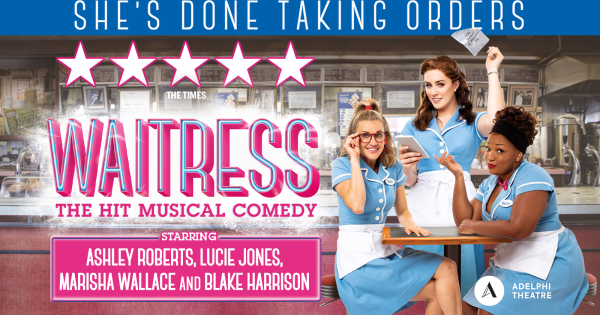
The image size is (600, 315). I want to click on coffee carafe, so click(x=573, y=129).